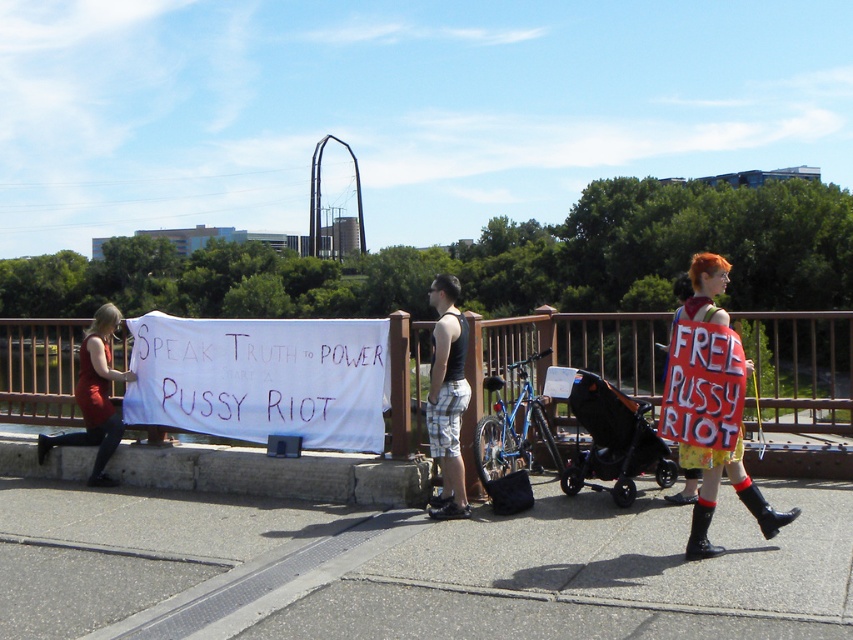
Question: Is gray asphalt at lower center to the left of black mesh tank top at center from the viewer's perspective?

Choices:
 (A) yes
 (B) no

Answer: (A)

Question: Which point appears farthest from the camera in this image?

Choices:
 (A) (442, 458)
 (B) (701, 540)

Answer: (A)

Question: Among these points, which one is farthest from the camera?

Choices:
 (A) (323, 392)
 (B) (70, 364)
 (C) (567, 484)
 (D) (698, 269)

Answer: (B)

Question: Among these objects, which one is nearest to the camera?

Choices:
 (A) white painted metal railing at center
 (B) black fabric stroller at center
 (C) white fabric banner at center

Answer: (A)

Question: Is white fabric banner at center further to camera compared to red fabric sign at right?

Choices:
 (A) no
 (B) yes

Answer: (B)

Question: Does white painted metal railing at center have a greater width compared to white fabric banner at center?

Choices:
 (A) yes
 (B) no

Answer: (A)